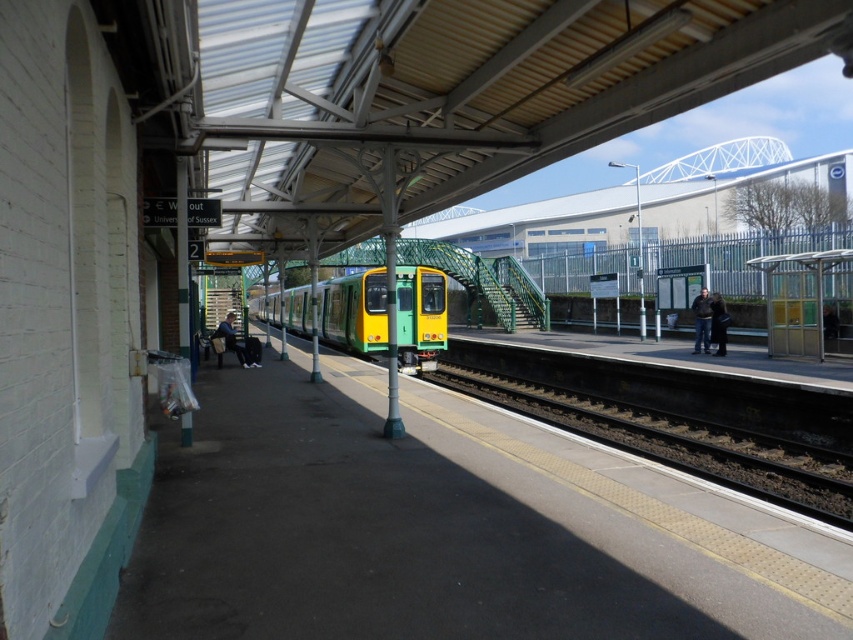
Who is more distant from viewer, (697, 634) or (540, 417)?

Positioned behind is point (540, 417).

Where is `smooth concrete platform at lower left`? Image resolution: width=853 pixels, height=640 pixels. smooth concrete platform at lower left is located at coordinates (450, 529).

Is point (457, 384) farther from camera compared to point (703, 339)?

Yes, it is.

Between black asphalt track at center and dark blue jeans at right, which one has less height?

black asphalt track at center

At what (x,y) coordinates should I click in order to perform the action: click on black asphalt track at center. Please return your answer as a coordinate pair (x, y). Looking at the image, I should click on (676, 440).

Is green matte train at center thinner than dark brown leather jacket at right?

No, green matte train at center is not thinner than dark brown leather jacket at right.

Who is more distant from viewer, (407,269) or (712,317)?

Positioned behind is point (407,269).

Who is more forward, (398, 332) or (715, 304)?

Positioned in front is point (715, 304).

I want to click on green matte train at center, so click(354, 310).